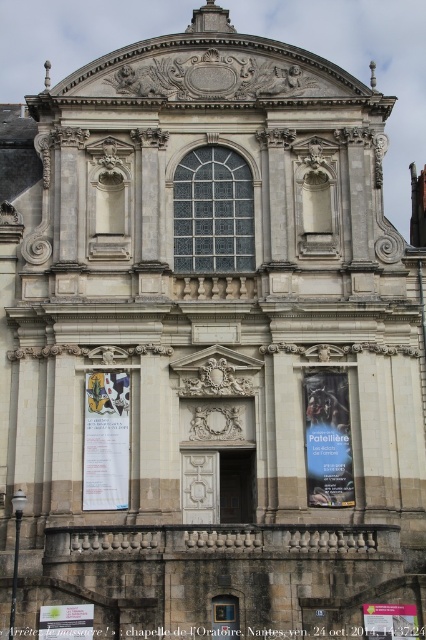
Question: Does white paper poster at center have a lesser width compared to blue glossy poster at center?

Choices:
 (A) yes
 (B) no

Answer: (B)

Question: Which object is positioned farthest from the matte paper poster at center?

Choices:
 (A) blue glossy poster at center
 (B) white paper poster at center

Answer: (B)

Question: Can you confirm if white paper poster at center is smaller than matte paper poster at center?

Choices:
 (A) yes
 (B) no

Answer: (B)

Question: Which point is farther from the camera taking this photo?

Choices:
 (A) (123, 396)
 (B) (374, 609)

Answer: (A)

Question: Is white paper poster at center bigger than green paper poster at lower left?

Choices:
 (A) yes
 (B) no

Answer: (A)

Question: Which point appears farthest from the camera in this image?

Choices:
 (A) (316, 374)
 (B) (400, 611)

Answer: (A)